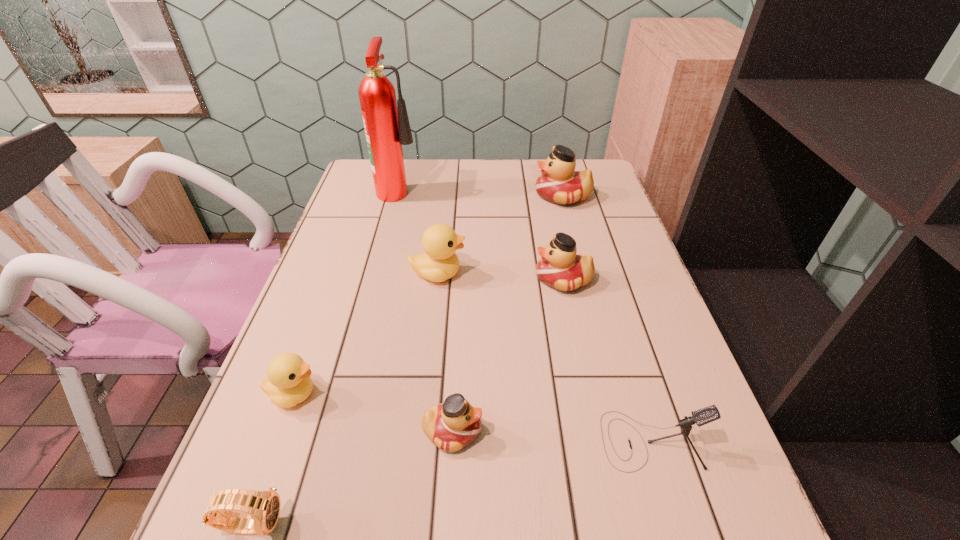
The width and height of the screenshot is (960, 540). What are the coordinates of `the nearest red duck` in the screenshot? It's located at 454,424.

Locate an element on the screen. This screenshot has height=540, width=960. the leftmost red duck is located at coordinates (454, 424).

Identify the location of vacant area situated 0.260m at the nozzle of the tallest object. (501, 189).

Where is `blank area located 0.400m on the face of the farthest duck`? Image resolution: width=960 pixels, height=540 pixels. blank area located 0.400m on the face of the farthest duck is located at coordinates (408, 196).

At what (x,y) coordinates should I click in order to perform the action: click on free space located 0.200m on the face of the farthest duck. Please return your answer as a coordinate pair (x, y). The image size is (960, 540). Looking at the image, I should click on (471, 196).

Locate an element on the screen. Image resolution: width=960 pixels, height=540 pixels. free location located on the face of the farthest duck is located at coordinates (449, 196).

Identify the location of free spot located 0.180m on the face of the bigger yellow duck. (537, 274).

Find the location of a particular element. The height and width of the screenshot is (540, 960). vacant space located on the face of the second farthest red duck is located at coordinates (515, 279).

You are a GUI agent. You are given a task and a screenshot of the screen. Output one action in this format:
    pyautogui.click(x=<x>, y=<y>)
    Task: Click on the vacant space located on the face of the second farthest red duck
    
    Given the screenshot: What is the action you would take?
    pyautogui.click(x=443, y=279)

Find the location of a particular element. vacant space situated 0.370m on the face of the second farthest red duck is located at coordinates (387, 279).